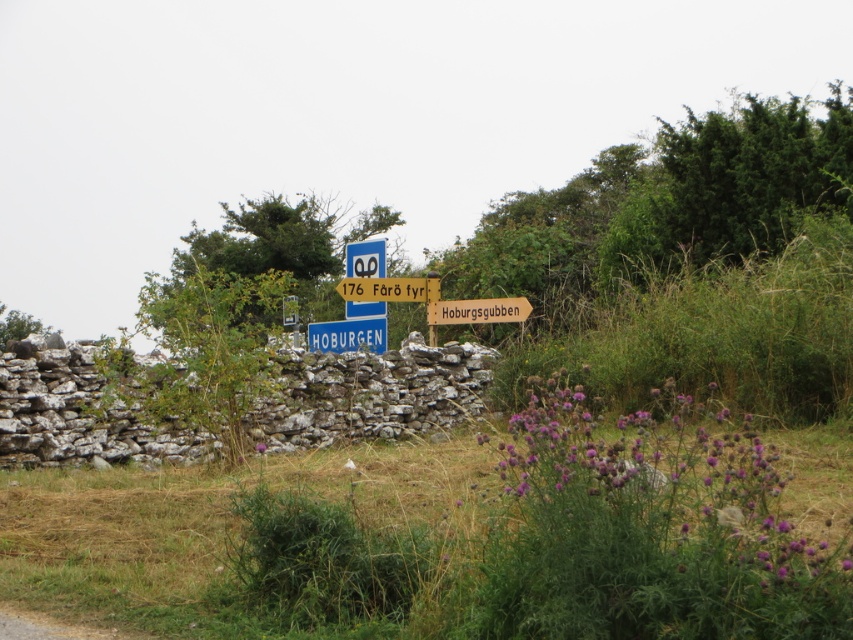
Consider the image. Does brown wooden signpost at center appear under yellow wooden signpost at center?

Incorrect, brown wooden signpost at center is not positioned below yellow wooden signpost at center.

Is brown wooden signpost at center positioned in front of yellow wooden signpost at center?

Yes, brown wooden signpost at center is closer to the viewer.

Which is behind, point (512, 305) or point (426, 298)?

Point (426, 298)

At what (x,y) coordinates should I click in order to perform the action: click on brown wooden signpost at center. Please return your answer as a coordinate pair (x, y). Looking at the image, I should click on (479, 310).